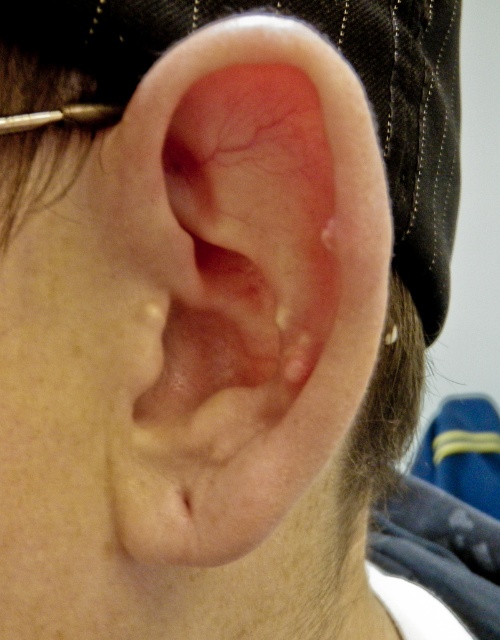
Question: Which of the following is the farthest from the observer?

Choices:
 (A) (266, 280)
 (B) (384, 337)

Answer: (B)

Question: Can you confirm if pink flesh-colored ear at center is thinner than silver metallic earring at upper left?

Choices:
 (A) no
 (B) yes

Answer: (A)

Question: Which object is closer to the camera taking this photo?

Choices:
 (A) silver metallic earring at upper left
 (B) pink flesh-colored ear at center

Answer: (B)

Question: Can you confirm if pink flesh-colored ear at center is wider than silver metallic earring at upper left?

Choices:
 (A) no
 (B) yes

Answer: (B)

Question: Where is pink flesh-colored ear at center located in relation to silver metallic earring at upper left in the image?

Choices:
 (A) left
 (B) right

Answer: (A)

Question: Which of the following is the closest to the observer?

Choices:
 (A) pink flesh-colored ear at center
 (B) silver metallic earring at upper left

Answer: (A)